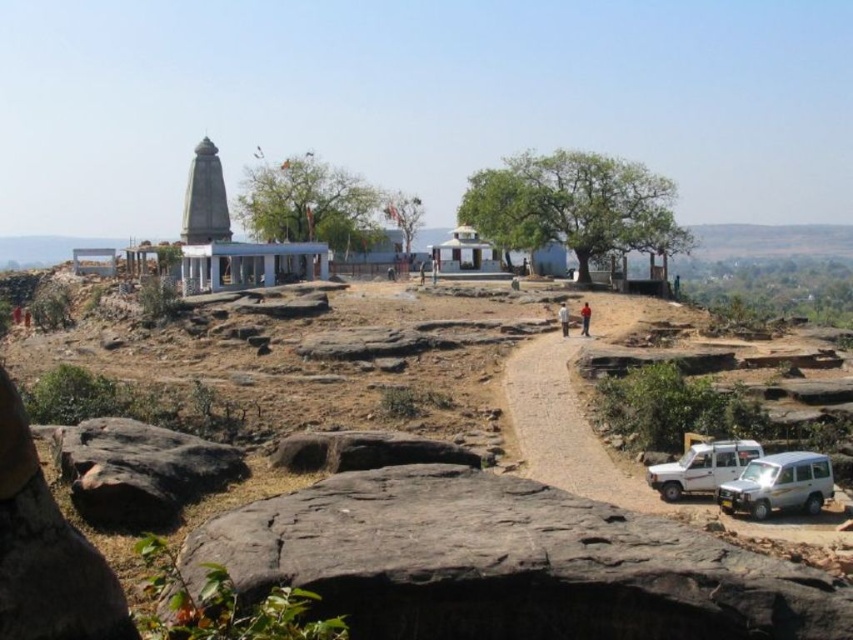
You are standing at the base of the hill looking up at the scene. Which object is positioned to the right side when comparing the dark gray rock at lower center and the brown rough rock at center?

The dark gray rock at lower center is positioned to the right of the brown rough rock at center.

You are a tourist standing at the base of the hill in the image. You want to take a photo of the dark gray rock at lower center and the white matte jeep at lower right in the same frame. Which object should you move towards to ensure both are visible?

You should move towards the white matte jeep at lower right because the dark gray rock at lower center is in front of it, so moving towards the back object would allow both to be in the frame.

You are standing at the point marked as point (x=508, y=563) in the image. What object is directly beneath your feet?

The dark gray rock at lower center is directly beneath your feet at point (x=508, y=563).